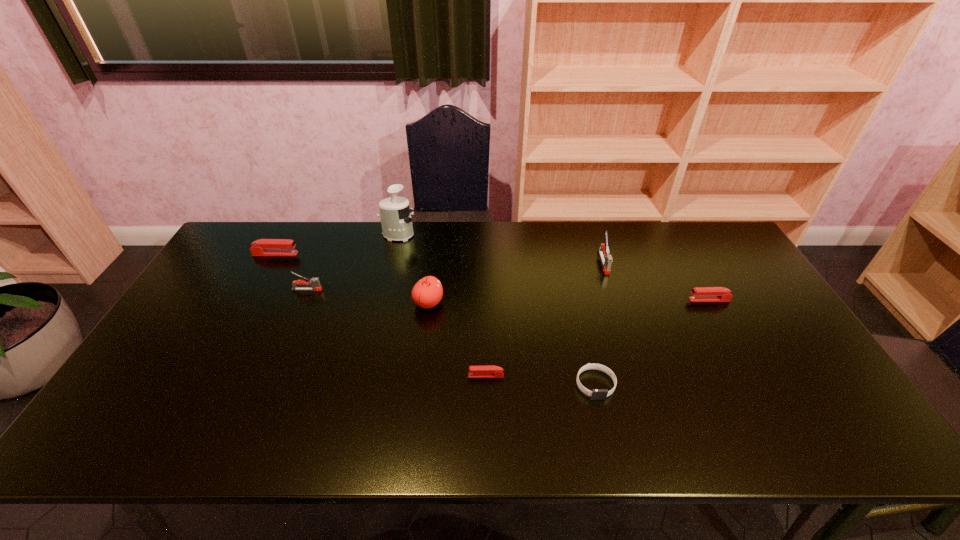
Locate an element on the screen. juicer is located at coordinates (396, 221).

The width and height of the screenshot is (960, 540). What are the coordinates of `the farthest object` in the screenshot? It's located at (396, 221).

The image size is (960, 540). What are the coordinates of `the farther gray stapler` in the screenshot? It's located at (606, 259).

Locate an element on the screen. The image size is (960, 540). the right gray stapler is located at coordinates (606, 259).

You are a GUI agent. You are given a task and a screenshot of the screen. Output one action in this format:
    pyautogui.click(x=<x>, y=<y>)
    Task: Click on the apple
    This screenshot has width=960, height=540.
    Given the screenshot: What is the action you would take?
    click(x=427, y=292)

The height and width of the screenshot is (540, 960). What are the coordinates of `the fourth object from left to right` in the screenshot? It's located at (427, 292).

Identify the location of the fourth shortest stapler. (314, 282).

Where is `the third farthest stapler`? Image resolution: width=960 pixels, height=540 pixels. the third farthest stapler is located at coordinates (314, 282).

Where is `the leftmost red stapler`? the leftmost red stapler is located at coordinates (263, 247).

This screenshot has width=960, height=540. Identify the location of the fifth tallest object. (263, 247).